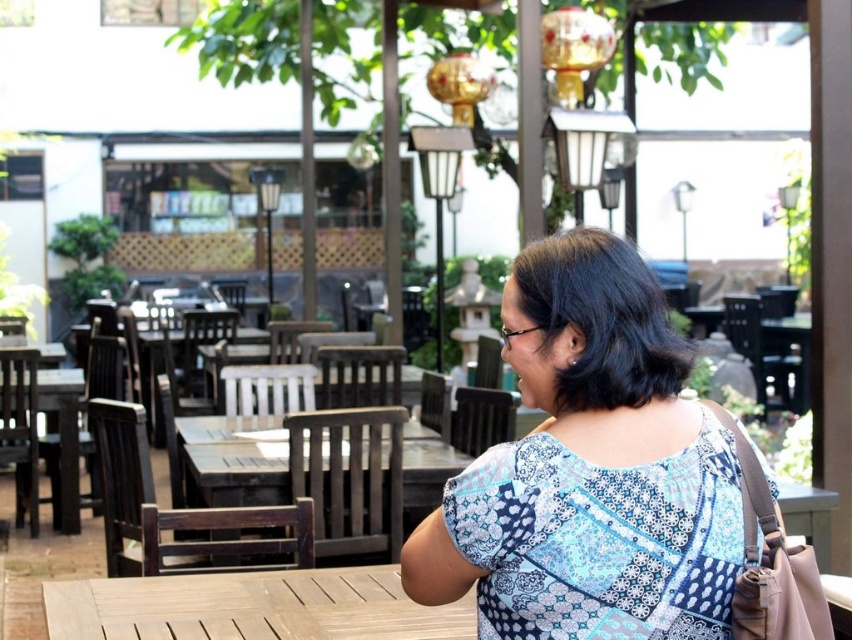
You are a customer at the outdoor seating area and want to choose a table that can accommodate a large group. Based on the scene, which table between the wooden table at center and the wooden table at left would you select?

The wooden table at center has a larger width than the wooden table at left, so it can accommodate a larger group.

You are a customer at the outdoor seating area and want to choose a table. You prefer a smaller table for your solo meal. Which table should you choose between the light brown wooden table at center and the wooden table at left?

The light brown wooden table at center has a smaller size compared to wooden table at left, so you should choose the light brown wooden table at center for your solo meal.